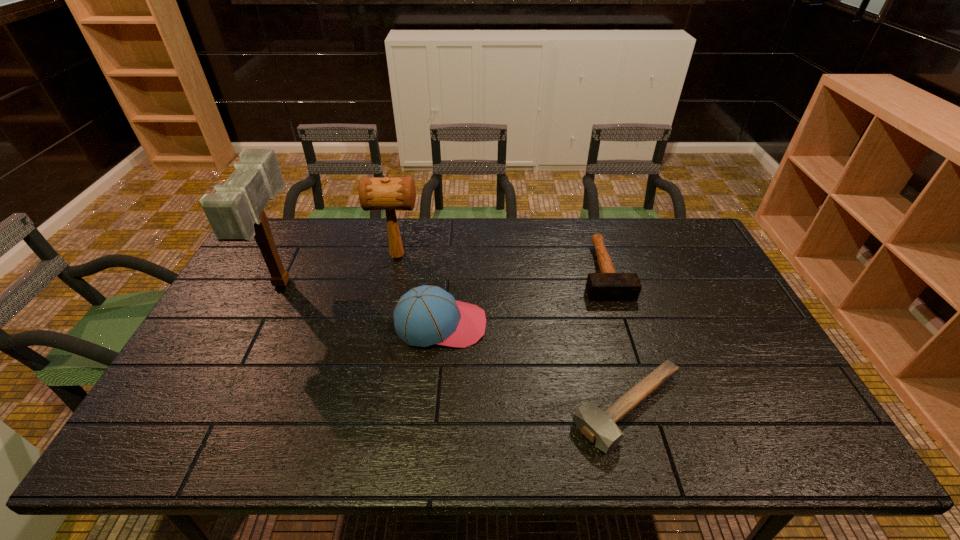
Where is `the leftmost object`? the leftmost object is located at coordinates (235, 212).

Locate an element on the screen. Image resolution: width=960 pixels, height=540 pixels. the tallest mallet is located at coordinates (235, 212).

Locate an element on the screen. This screenshot has width=960, height=540. the second tallest mallet is located at coordinates (389, 194).

You are a GUI agent. You are given a task and a screenshot of the screen. Output one action in this format:
    pyautogui.click(x=<x>, y=<y>)
    Task: Click on the fourth shortest object
    The image size is (960, 540).
    Given the screenshot: What is the action you would take?
    pyautogui.click(x=389, y=194)

Locate an element on the screen. Image resolution: width=960 pixels, height=540 pixels. the third shortest object is located at coordinates (426, 315).

You are a GUI agent. You are given a task and a screenshot of the screen. Output one action in this format:
    pyautogui.click(x=<x>, y=<y>)
    Task: Click on the second shortest mallet
    The width and height of the screenshot is (960, 540).
    Given the screenshot: What is the action you would take?
    pyautogui.click(x=608, y=285)

This screenshot has width=960, height=540. I want to click on the nearest mallet, so click(599, 427).

At what (x,y) coordinates should I click in order to perform the action: click on the shortest mallet. Please return your answer as a coordinate pair (x, y). This screenshot has height=540, width=960. Looking at the image, I should click on (x=599, y=427).

This screenshot has width=960, height=540. In order to click on blank area located on the front of the leftmost object in this screenshot , I will do `click(257, 334)`.

Where is `free space located on the strike surface of the second tallest mallet`? free space located on the strike surface of the second tallest mallet is located at coordinates (441, 256).